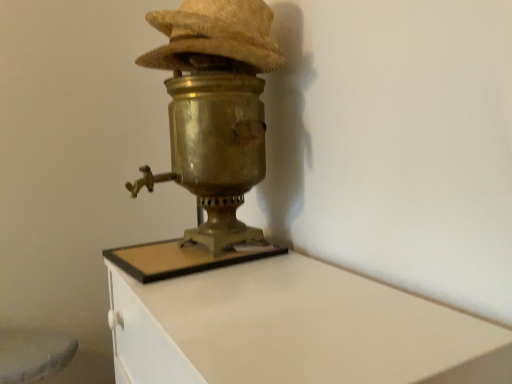
This screenshot has height=384, width=512. What do you see at coordinates (215, 35) in the screenshot?
I see `woven straw hat at upper center` at bounding box center [215, 35].

Find the location of a particular element. This screenshot has width=512, height=384. woven straw hat at upper center is located at coordinates (215, 35).

Is woven straw hat at upper center surrounded by brass samovar at center?

No, woven straw hat at upper center is not a part of brass samovar at center.

Is brass samovar at center at the left side of woven straw hat at upper center?

In fact, brass samovar at center is to the right of woven straw hat at upper center.

Is brass samovar at center far away from woven straw hat at upper center?

brass samovar at center is near woven straw hat at upper center, not far away.

From a real-world perspective, which is physically above, brass samovar at center or woven straw hat at upper center?

In real-world perspective, woven straw hat at upper center is above.

Identify the location of hat located above the brass/bronze table lamp at center (from a real-world perspective). (215, 35).

Can you confirm if woven straw hat at upper center is wider than brass/bronze table lamp at center?

Incorrect, the width of woven straw hat at upper center does not surpass that of brass/bronze table lamp at center.

Consider the image. Is woven straw hat at upper center located outside brass/bronze table lamp at center?

Actually, woven straw hat at upper center is at least partially inside brass/bronze table lamp at center.

Is there a large distance between woven straw hat at upper center and brass/bronze table lamp at center?

No, there isn't a large distance between woven straw hat at upper center and brass/bronze table lamp at center.

Based on the photo, from the image's perspective, between woven straw hat at upper center and brass samovar at center, which one is located above?

woven straw hat at upper center, from the image's perspective.

Would you say woven straw hat at upper center is outside brass samovar at center?

Yes, woven straw hat at upper center is not within brass samovar at center.

From the picture: Is woven straw hat at upper center wider or thinner than brass samovar at center?

Considering their sizes, woven straw hat at upper center looks slimmer than brass samovar at center.

Is woven straw hat at upper center oriented towards brass samovar at center?

No, woven straw hat at upper center is not facing towards brass samovar at center.

Is brass/bronze table lamp at center behind brass samovar at center?

Yes, brass/bronze table lamp at center is further from the viewer.

Who is bigger, brass/bronze table lamp at center or brass samovar at center?

With larger size is brass samovar at center.

Is brass/bronze table lamp at center not close to brass samovar at center?

No, brass/bronze table lamp at center is not far from brass samovar at center.

From a real-world perspective, who is located lower, brass/bronze table lamp at center or woven straw hat at upper center?

brass/bronze table lamp at center.

Are brass/bronze table lamp at center and woven straw hat at upper center making contact?

brass/bronze table lamp at center and woven straw hat at upper center are not in contact.

Is point (209, 247) closer or farther from the camera than point (241, 20)?

Point (209, 247).

Is brass/bronze table lamp at center behind woven straw hat at upper center?

No, brass/bronze table lamp at center is closer to the camera.

Are brass samovar at center and brass/bronze table lamp at center making contact?

No, brass samovar at center is not making contact with brass/bronze table lamp at center.

Based on the photo, how many degrees apart are the facing directions of brass samovar at center and brass/bronze table lamp at center?

6.92 degrees separate the facing orientations of brass samovar at center and brass/bronze table lamp at center.

Is brass samovar at center spatially inside brass/bronze table lamp at center, or outside of it?

brass samovar at center lies outside brass/bronze table lamp at center.

Image resolution: width=512 pixels, height=384 pixels. In order to click on furniture below the brass/bronze table lamp at center (from a real-world perspective) in this screenshot , I will do `click(294, 329)`.

Where is `furniture below the woven straw hat at upper center (from the image's perspective)`? furniture below the woven straw hat at upper center (from the image's perspective) is located at coordinates [x=294, y=329].

This screenshot has width=512, height=384. I want to click on table lamp below the woven straw hat at upper center (from a real-world perspective), so click(209, 131).

Which object lies nearer to the anchor point brass/bronze table lamp at center, woven straw hat at upper center or brass samovar at center?

woven straw hat at upper center lies closer to brass/bronze table lamp at center than the other object.

Based on their spatial positions, is brass samovar at center or brass/bronze table lamp at center further from woven straw hat at upper center?

brass samovar at center.

Considering their positions, is woven straw hat at upper center positioned closer to brass samovar at center than brass/bronze table lamp at center?

The object closer to brass samovar at center is brass/bronze table lamp at center.

Looking at this image, based on their spatial positions, is brass/bronze table lamp at center or woven straw hat at upper center further from brass samovar at center?

woven straw hat at upper center lies further to brass samovar at center than the other object.

Which object lies further to the anchor point woven straw hat at upper center, brass/bronze table lamp at center or brass samovar at center?

brass samovar at center is positioned further to the anchor woven straw hat at upper center.

Which object lies further to the anchor point brass/bronze table lamp at center, brass samovar at center or woven straw hat at upper center?

brass samovar at center is further to brass/bronze table lamp at center.

Where is `table lamp between woven straw hat at upper center and brass samovar at center vertically`? The height and width of the screenshot is (384, 512). table lamp between woven straw hat at upper center and brass samovar at center vertically is located at coordinates (209, 131).